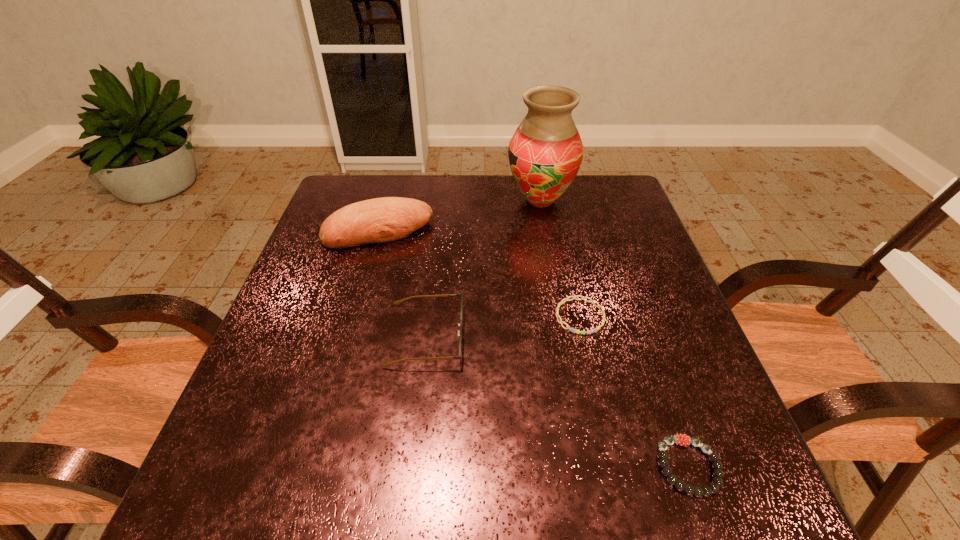
Find the location of a particular element. The image size is (960, 540). free space at the right edge of the desktop is located at coordinates (632, 275).

The width and height of the screenshot is (960, 540). I want to click on blank space at the near left corner of the desktop, so click(x=236, y=512).

Where is `blank region between the tallest object and the second tallest object`? blank region between the tallest object and the second tallest object is located at coordinates (460, 215).

You are a GUI agent. You are given a task and a screenshot of the screen. Output one action in this format:
    pyautogui.click(x=<x>, y=<y>)
    Task: Click on the vacant space that is in between the left bracelet and the right bracelet
    Image resolution: width=960 pixels, height=540 pixels.
    Given the screenshot: What is the action you would take?
    pyautogui.click(x=635, y=392)

You are a GUI agent. You are given a task and a screenshot of the screen. Output one action in this format:
    pyautogui.click(x=<x>, y=<y>)
    Task: Click on the vacant area that lies between the rightmost object and the left bracelet
    
    Given the screenshot: What is the action you would take?
    pyautogui.click(x=635, y=392)

The height and width of the screenshot is (540, 960). What are the coordinates of `vacant area that lies between the third tallest object and the farther bracelet` in the screenshot? It's located at (503, 326).

Find the location of a particular element. The height and width of the screenshot is (540, 960). unoccupied area between the spectacles and the right bracelet is located at coordinates (557, 401).

Locate an element on the screen. free space between the third shortest object and the second tallest object is located at coordinates (402, 283).

Where is `free space between the bread and the rightmost object`? Image resolution: width=960 pixels, height=540 pixels. free space between the bread and the rightmost object is located at coordinates (534, 349).

The height and width of the screenshot is (540, 960). What are the coordinates of `vacant area between the tallest object and the spectacles` in the screenshot? It's located at (483, 268).